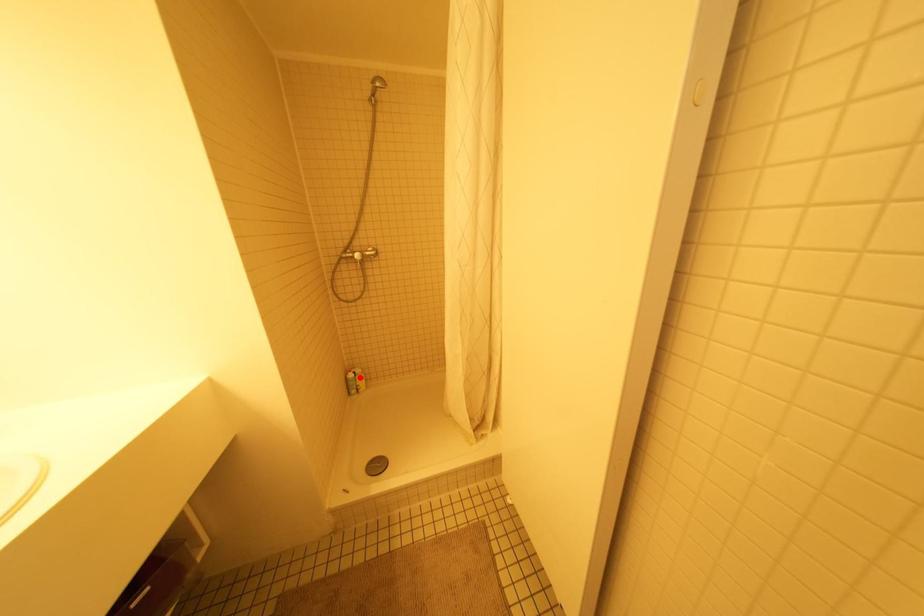
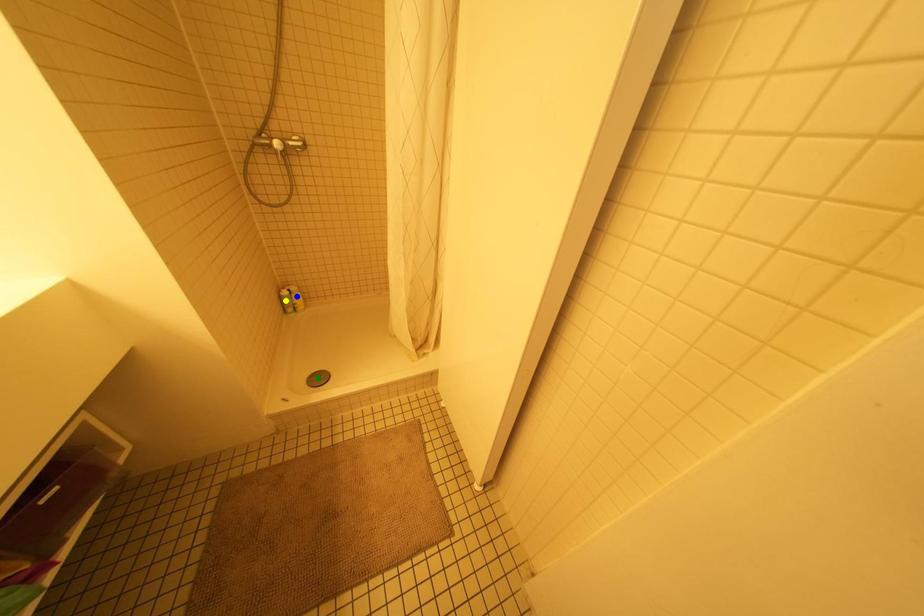
Question: I am providing you with two images of the same scene from different viewpoints. A red point is marked on the first image. You are given multiple points on the second image. Which point in image 2 is actually the same real-world point as the red point in image 1?

Choices:
 (A) blue point
 (B) green point
 (C) yellow point

Answer: (A)